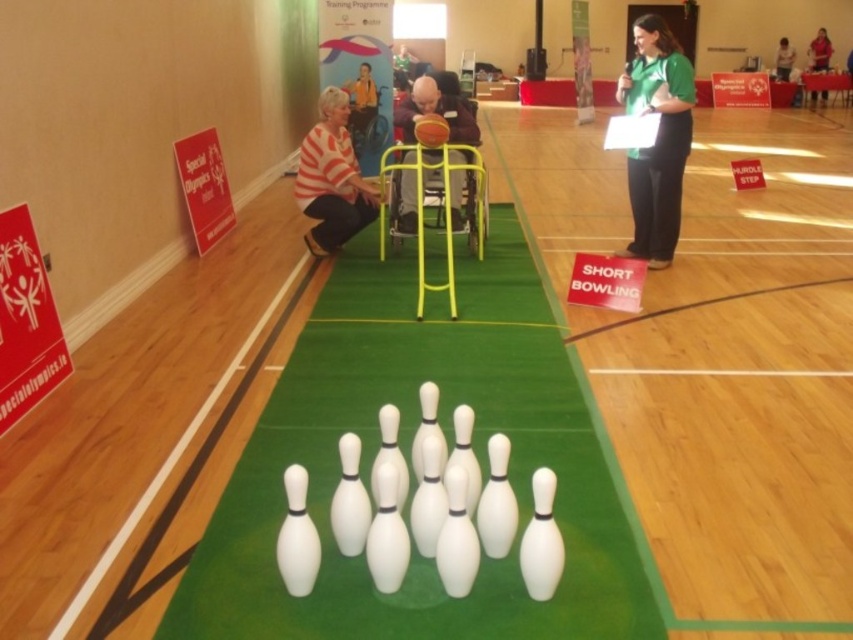
You are a photographer at the indoor bowling event. You want to capture a photo that includes both the white striped shirt at center and the white plastic bowling pins at center. Which object will appear larger in the photo?

The white striped shirt at center will appear larger in the photo because it is closer to the viewer than the white plastic bowling pins at center.

You are a volunteer at the Special Olympics event. You need to guide a participant to the bowling lane. The participant is currently facing the white plastic bowling pins at center. Which direction should they turn to locate the volunteer in the white striped shirt at center?

The volunteer in the white striped shirt at center is to the right of the white plastic bowling pins at center, so the participant should turn to their right to locate the volunteer.

You are a photographer at the indoor bowling event. You need to capture a photo where both the green fabric shirt at upper right and the matte green shirt at upper center are visible. Which shirt should you focus on first to ensure both are in frame?

You should focus on the matte green shirt at upper center first since it is larger than the green fabric shirt at upper right, ensuring it fits within the frame while also capturing the smaller one.